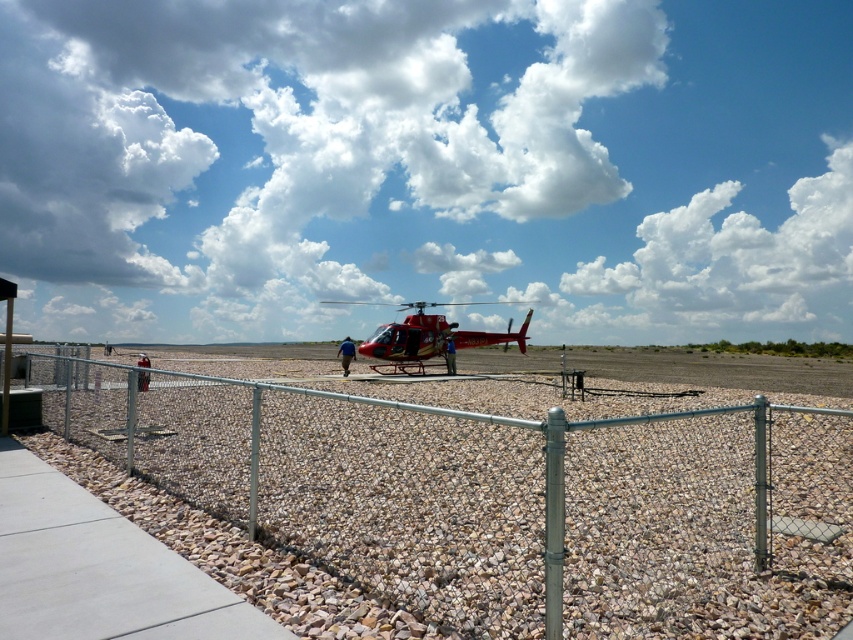
Consider the image. Can you confirm if silver chain-link fence at center is positioned above red glossy helicopter at center?

No.

Based on the photo, is silver chain-link fence at center further to the viewer compared to red glossy helicopter at center?

No, silver chain-link fence at center is in front of red glossy helicopter at center.

Describe the element at coordinates (486, 492) in the screenshot. The height and width of the screenshot is (640, 853). I see `silver chain-link fence at center` at that location.

Where is `silver chain-link fence at center`? silver chain-link fence at center is located at coordinates (486, 492).